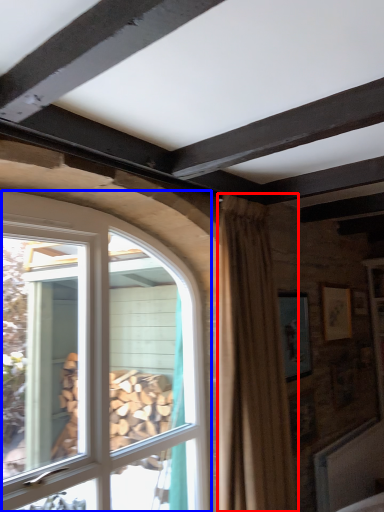
Question: Which point is further to the camera, curtain (highlighted by a red box) or window (highlighted by a blue box)?

Choices:
 (A) curtain
 (B) window

Answer: (A)